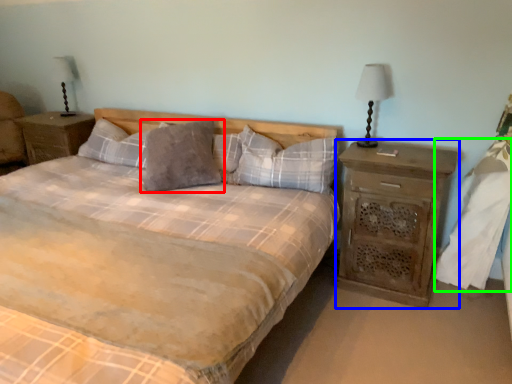
Question: Considering the real-world distances, which object is farthest from pillow (highlighted by a red box)? nightstand (highlighted by a blue box) or sheet (highlighted by a green box)?

Choices:
 (A) nightstand
 (B) sheet

Answer: (B)